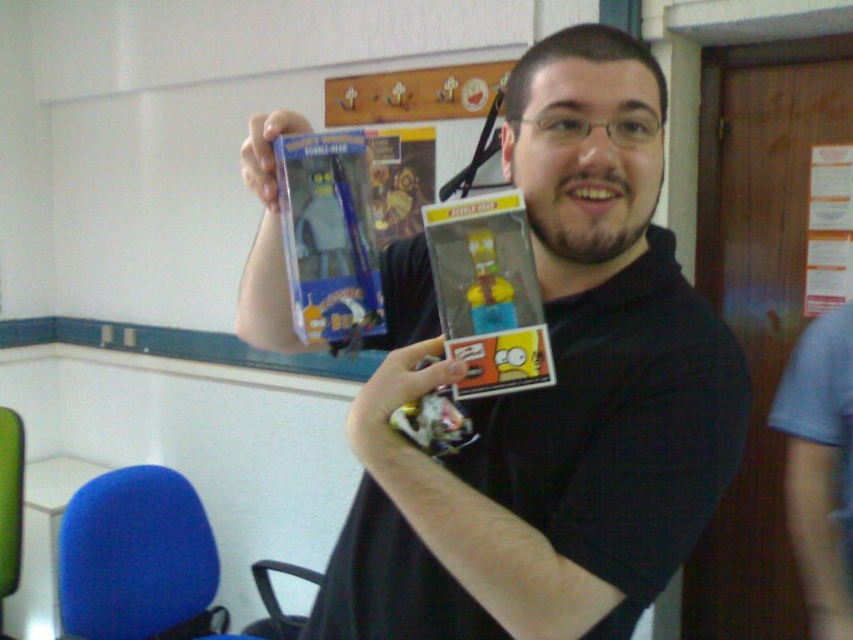
Question: Is glossy plastic toy at upper center closer to camera compared to matte plastic toy at center?

Choices:
 (A) no
 (B) yes

Answer: (A)

Question: Which point appears closest to the camera in this image?

Choices:
 (A) (309, 273)
 (B) (546, 365)
 (C) (397, 428)
 (D) (271, 198)

Answer: (B)

Question: Can you confirm if matte black figure at center is smaller than glossy plastic toy at upper center?

Choices:
 (A) yes
 (B) no

Answer: (B)

Question: Which object is closer to the camera taking this photo?

Choices:
 (A) matte plastic toy at center
 (B) matte plastic toy at upper center

Answer: (A)

Question: Which object is closer to the camera taking this photo?

Choices:
 (A) matte plastic toy at upper center
 (B) translucent plastic figure at center
 (C) glossy plastic toy at upper center

Answer: (B)

Question: Can you confirm if translucent plastic figure at center is positioned below matte plastic toy at upper center?

Choices:
 (A) no
 (B) yes

Answer: (B)